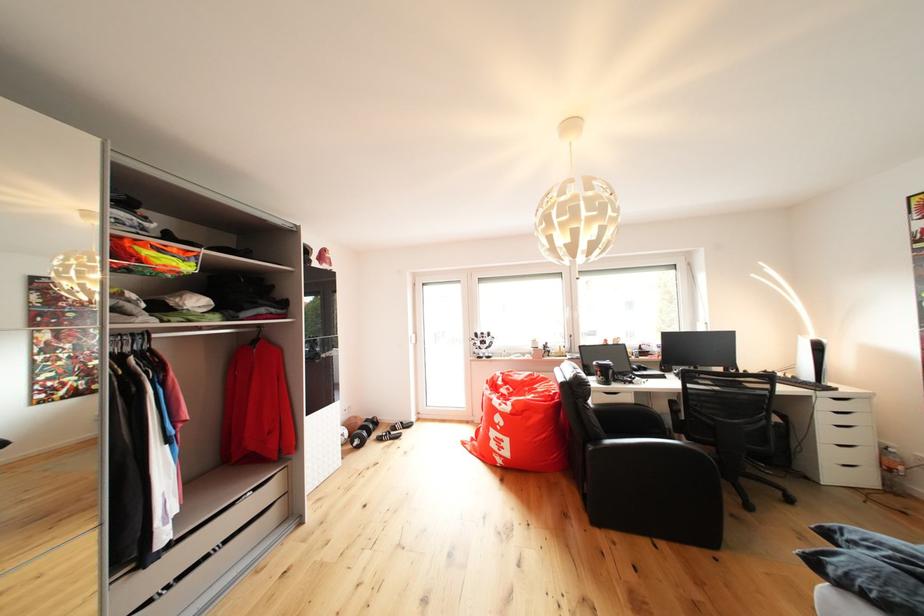
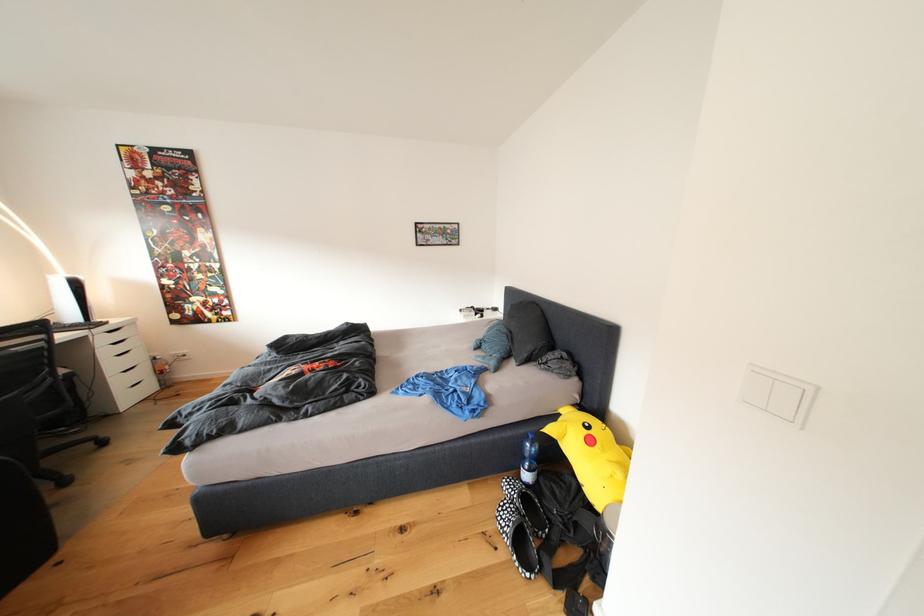
The point at (835, 438) is marked in the first image. Where is the corresponding point in the second image?

(120, 370)